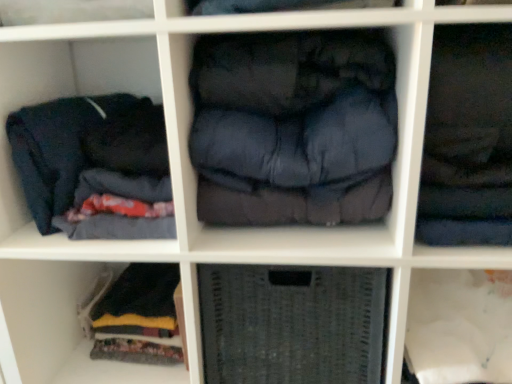
Locate an element on the screen. dark blue fabric at left, which is the 1th clothing in left-to-right order is located at coordinates (77, 167).

What do you see at coordinates (468, 139) in the screenshot? The height and width of the screenshot is (384, 512). I see `dark blue fabric at upper right, the first clothing from the right` at bounding box center [468, 139].

In order to face gray woven basket at center, should I rotate leftwards or rightwards?

You should rotate right by 5.206 degrees.

You are a GUI agent. You are given a task and a screenshot of the screen. Output one action in this format:
    pyautogui.click(x=<x>, y=<y>)
    Task: Click on the dark blue fabric at left, the 3th clothing in the right-to-left sequence
    This screenshot has width=512, height=384.
    Given the screenshot: What is the action you would take?
    pyautogui.click(x=77, y=167)

Is dark blue quilted jacket at center, which is counted as the second clothing, starting from the left, positioned with its back to dark blue fabric at upper right, which is counted as the third clothing, starting from the left?

No, dark blue fabric at upper right, which is counted as the third clothing, starting from the left, is not at the back of dark blue quilted jacket at center, which is counted as the second clothing, starting from the left.

I want to click on clothing above the dark blue quilted jacket at center, the second clothing viewed from the right (from the image's perspective), so click(x=468, y=139).

From the image's perspective, is dark blue quilted jacket at center, the second clothing viewed from the right, located beneath dark blue fabric at upper right, which is counted as the third clothing, starting from the left?

Yes, from the image's perspective, dark blue quilted jacket at center, the second clothing viewed from the right, is below dark blue fabric at upper right, which is counted as the third clothing, starting from the left.

Is point (362, 74) closer or farther from the camera than point (423, 186)?

Point (362, 74).

Based on the photo, is gray woven basket at center smaller than dark blue fabric at upper right, which is counted as the third clothing, starting from the left?

Actually, gray woven basket at center might be larger than dark blue fabric at upper right, which is counted as the third clothing, starting from the left.

What's the angular difference between gray woven basket at center and dark blue fabric at upper right, the first clothing from the right,'s facing directions?

There is a 6.63e-05-degree angle between the facing directions of gray woven basket at center and dark blue fabric at upper right, the first clothing from the right.

Is gray woven basket at center facing towards dark blue fabric at upper right, the first clothing from the right?

No, gray woven basket at center does not turn towards dark blue fabric at upper right, the first clothing from the right.

From the image's perspective, is gray woven basket at center located above or below dark blue fabric at upper right, which is counted as the third clothing, starting from the left?

Based on their image positions, gray woven basket at center is located beneath dark blue fabric at upper right, which is counted as the third clothing, starting from the left.

Based on their sizes in the image, would you say gray woven basket at center is bigger or smaller than dark blue fabric at left, which is the 1th clothing in left-to-right order?

In the image, gray woven basket at center appears to be larger than dark blue fabric at left, which is the 1th clothing in left-to-right order.

Which object is closer to the camera, gray woven basket at center or dark blue fabric at left, which is the 1th clothing in left-to-right order?

dark blue fabric at left, which is the 1th clothing in left-to-right order.

Which is closer, (314,351) or (170,236)?

Point (314,351) is farther from the camera than point (170,236).

Considering the positions of objects gray woven basket at center and dark blue fabric at left, which is the 1th clothing in left-to-right order, in the image provided, who is more to the right, gray woven basket at center or dark blue fabric at left, which is the 1th clothing in left-to-right order,?

From the viewer's perspective, gray woven basket at center appears more on the right side.

Are dark blue quilted jacket at center, the second clothing viewed from the right, and dark blue fabric at left, which is the 1th clothing in left-to-right order, beside each other?

No, dark blue quilted jacket at center, the second clothing viewed from the right, is not in contact with dark blue fabric at left, which is the 1th clothing in left-to-right order.

In terms of width, does dark blue quilted jacket at center, which is counted as the second clothing, starting from the left, look wider or thinner when compared to dark blue fabric at left, the 3th clothing in the right-to-left sequence?

dark blue quilted jacket at center, which is counted as the second clothing, starting from the left, is thinner than dark blue fabric at left, the 3th clothing in the right-to-left sequence.

Considering the relative positions of dark blue quilted jacket at center, which is counted as the second clothing, starting from the left, and dark blue fabric at left, the 3th clothing in the right-to-left sequence, in the image provided, is dark blue quilted jacket at center, which is counted as the second clothing, starting from the left, to the left of dark blue fabric at left, the 3th clothing in the right-to-left sequence, from the viewer's perspective?

In fact, dark blue quilted jacket at center, which is counted as the second clothing, starting from the left, is to the right of dark blue fabric at left, the 3th clothing in the right-to-left sequence.

Can you tell me how much dark blue quilted jacket at center, the second clothing viewed from the right, and dark blue fabric at left, which is the 1th clothing in left-to-right order, differ in facing direction?

There is a 7.62e-05-degree angle between the facing directions of dark blue quilted jacket at center, the second clothing viewed from the right, and dark blue fabric at left, which is the 1th clothing in left-to-right order.

Measure the distance between dark blue fabric at upper right, which is counted as the third clothing, starting from the left, and dark blue quilted jacket at center, the second clothing viewed from the right.

7.08 inches.

Between dark blue fabric at upper right, the first clothing from the right, and dark blue quilted jacket at center, the second clothing viewed from the right, which one appears on the right side from the viewer's perspective?

Positioned to the right is dark blue fabric at upper right, the first clothing from the right.

From a real-world perspective, is dark blue fabric at upper right, which is counted as the third clothing, starting from the left, positioned under dark blue quilted jacket at center, which is counted as the second clothing, starting from the left, based on gravity?

Yes.

Is dark blue fabric at upper right, which is counted as the third clothing, starting from the left, spatially inside dark blue quilted jacket at center, the second clothing viewed from the right, or outside of it?

dark blue fabric at upper right, which is counted as the third clothing, starting from the left, is located beyond the bounds of dark blue quilted jacket at center, the second clothing viewed from the right.

Which of these two, dark blue fabric at left, which is the 1th clothing in left-to-right order, or gray woven basket at center, stands shorter?

dark blue fabric at left, which is the 1th clothing in left-to-right order, is shorter.

Considering the relative sizes of dark blue fabric at left, the 3th clothing in the right-to-left sequence, and gray woven basket at center in the image provided, is dark blue fabric at left, the 3th clothing in the right-to-left sequence, wider than gray woven basket at center?

Correct, the width of dark blue fabric at left, the 3th clothing in the right-to-left sequence, exceeds that of gray woven basket at center.

Which is behind, point (57, 141) or point (209, 376)?

The point (209, 376) is more distant.

From a real-world perspective, which is physically above, dark blue fabric at upper right, which is counted as the third clothing, starting from the left, or dark blue fabric at left, which is the 1th clothing in left-to-right order?

dark blue fabric at upper right, which is counted as the third clothing, starting from the left, from a real-world perspective.

Considering the sizes of dark blue fabric at upper right, which is counted as the third clothing, starting from the left, and dark blue fabric at left, the 3th clothing in the right-to-left sequence, in the image, is dark blue fabric at upper right, which is counted as the third clothing, starting from the left, bigger or smaller than dark blue fabric at left, the 3th clothing in the right-to-left sequence,?

dark blue fabric at upper right, which is counted as the third clothing, starting from the left, is bigger than dark blue fabric at left, the 3th clothing in the right-to-left sequence.

Is dark blue fabric at upper right, the first clothing from the right, to the right of dark blue fabric at left, which is the 1th clothing in left-to-right order, from the viewer's perspective?

Correct, you'll find dark blue fabric at upper right, the first clothing from the right, to the right of dark blue fabric at left, which is the 1th clothing in left-to-right order.

Is dark blue fabric at upper right, the first clothing from the right, in front of or behind dark blue fabric at left, which is the 1th clothing in left-to-right order, in the image?

dark blue fabric at upper right, the first clothing from the right, is positioned closer to the viewer than dark blue fabric at left, which is the 1th clothing in left-to-right order.

From the dark blue fabric at upper right, the first clothing from the right, count the 1st clothing to the left and point to it. Please provide its 2D coordinates.

[(294, 128)]

From a real-world perspective, which clothing is the 2nd one above the gray woven basket at center? Please provide its 2D coordinates.

[(468, 139)]

From the image, which object appears to be nearer to gray woven basket at center, dark blue fabric at left, which is the 1th clothing in left-to-right order, or dark blue fabric at upper right, the first clothing from the right?

Among the two, dark blue fabric at upper right, the first clothing from the right, is located nearer to gray woven basket at center.

Looking at the image, which one is located further to dark blue fabric at left, which is the 1th clothing in left-to-right order, gray woven basket at center or dark blue fabric at upper right, the first clothing from the right?

dark blue fabric at upper right, the first clothing from the right, is positioned further to the anchor dark blue fabric at left, which is the 1th clothing in left-to-right order.

When comparing their distances from gray woven basket at center, does dark blue fabric at upper right, the first clothing from the right, or dark blue quilted jacket at center, which is counted as the second clothing, starting from the left, seem closer?

dark blue quilted jacket at center, which is counted as the second clothing, starting from the left, lies closer to gray woven basket at center than the other object.

Looking at the image, which one is located further to dark blue fabric at upper right, which is counted as the third clothing, starting from the left, dark blue fabric at left, which is the 1th clothing in left-to-right order, or gray woven basket at center?

Among the two, dark blue fabric at left, which is the 1th clothing in left-to-right order, is located further to dark blue fabric at upper right, which is counted as the third clothing, starting from the left.

Which object lies further to the anchor point gray woven basket at center, dark blue fabric at left, which is the 1th clothing in left-to-right order, or dark blue quilted jacket at center, which is counted as the second clothing, starting from the left?

dark blue fabric at left, which is the 1th clothing in left-to-right order, lies further to gray woven basket at center than the other object.

Considering their positions, is dark blue quilted jacket at center, which is counted as the second clothing, starting from the left, positioned closer to dark blue fabric at left, which is the 1th clothing in left-to-right order, than gray woven basket at center?

Among the two, dark blue quilted jacket at center, which is counted as the second clothing, starting from the left, is located nearer to dark blue fabric at left, which is the 1th clothing in left-to-right order.

Considering their positions, is dark blue quilted jacket at center, the second clothing viewed from the right, positioned further to dark blue fabric at upper right, the first clothing from the right, than dark blue fabric at left, which is the 1th clothing in left-to-right order?

dark blue fabric at left, which is the 1th clothing in left-to-right order, is further to dark blue fabric at upper right, the first clothing from the right.

Which object lies further to the anchor point dark blue fabric at upper right, the first clothing from the right, gray woven basket at center or dark blue fabric at left, which is the 1th clothing in left-to-right order?

dark blue fabric at left, which is the 1th clothing in left-to-right order, is positioned further to the anchor dark blue fabric at upper right, the first clothing from the right.

At what (x,y) coordinates should I click in order to perform the action: click on shelf between dark blue fabric at left, the 3th clothing in the right-to-left sequence, and dark blue fabric at upper right, which is counted as the third clothing, starting from the left. Please return your answer as a coordinate pair (x, y). The width and height of the screenshot is (512, 384). Looking at the image, I should click on (291, 324).

In order to click on clothing between dark blue fabric at left, the 3th clothing in the right-to-left sequence, and dark blue fabric at upper right, which is counted as the third clothing, starting from the left in this screenshot , I will do `click(294, 128)`.

The image size is (512, 384). I want to click on clothing between dark blue fabric at left, the 3th clothing in the right-to-left sequence, and gray woven basket at center, in the horizontal direction, so click(294, 128).